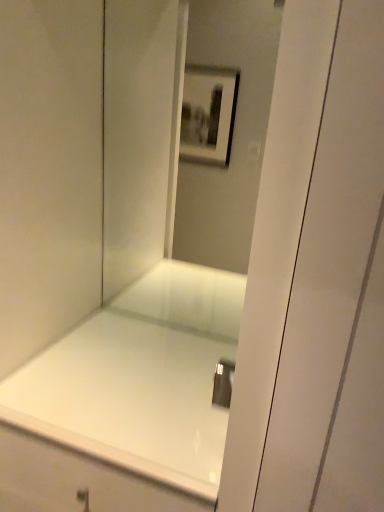
Describe the element at coordinates (233, 133) in the screenshot. I see `white glossy mirror at center` at that location.

Measure the distance between white glossy mirror at center and camera.

white glossy mirror at center and camera are 7.86 feet apart.

The width and height of the screenshot is (384, 512). Identify the location of white glossy mirror at center. (233, 133).

Locate an element on the screen. white glossy mirror at center is located at coordinates (233, 133).